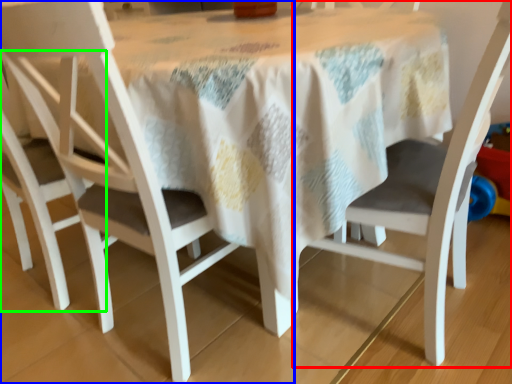
Question: Estimate the real-world distances between objects in this image. Which object is closer to chair (highlighted by a red box), chair (highlighted by a blue box) or chair (highlighted by a green box)?

Choices:
 (A) chair
 (B) chair

Answer: (A)